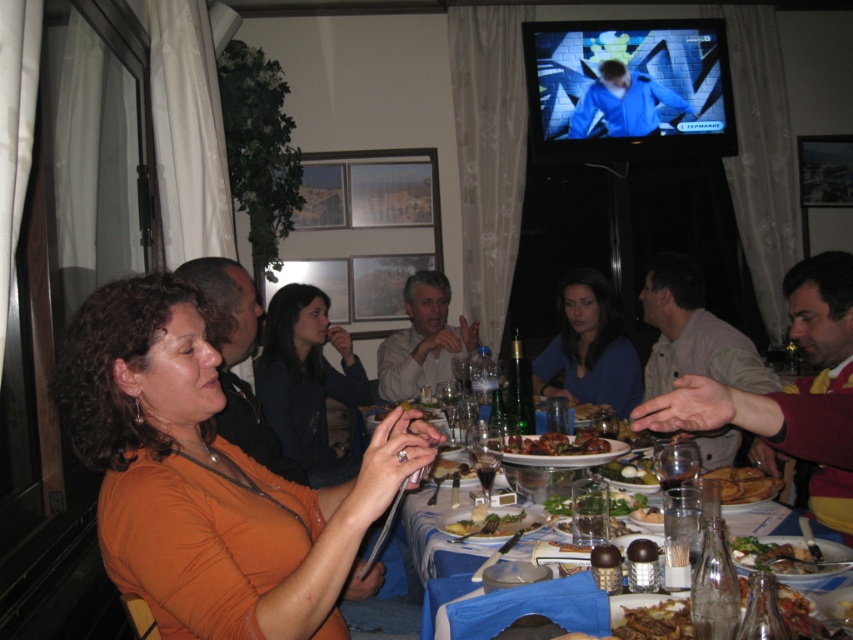
Question: Is wooden table at center above green leafy vegetable at center?

Choices:
 (A) yes
 (B) no

Answer: (A)

Question: Which of the following is the farthest from the observer?

Choices:
 (A) (300, 355)
 (B) (503, 534)

Answer: (A)

Question: Is dark blue sweater at center in front of smooth brown bread at center?

Choices:
 (A) yes
 (B) no

Answer: (B)

Question: Which object is farther from the camera taking this photo?

Choices:
 (A) smooth brown bread at center
 (B) orange fabric shirt at lower left

Answer: (A)

Question: Is light gray shirt at center to the left of green leafy vegetable at center from the viewer's perspective?

Choices:
 (A) no
 (B) yes

Answer: (A)

Question: Which object is the closest to the brown crispy chicken at center?

Choices:
 (A) orange fabric shirt at lower left
 (B) dark blue sweater at center
 (C) green leafy salad at lower right

Answer: (C)